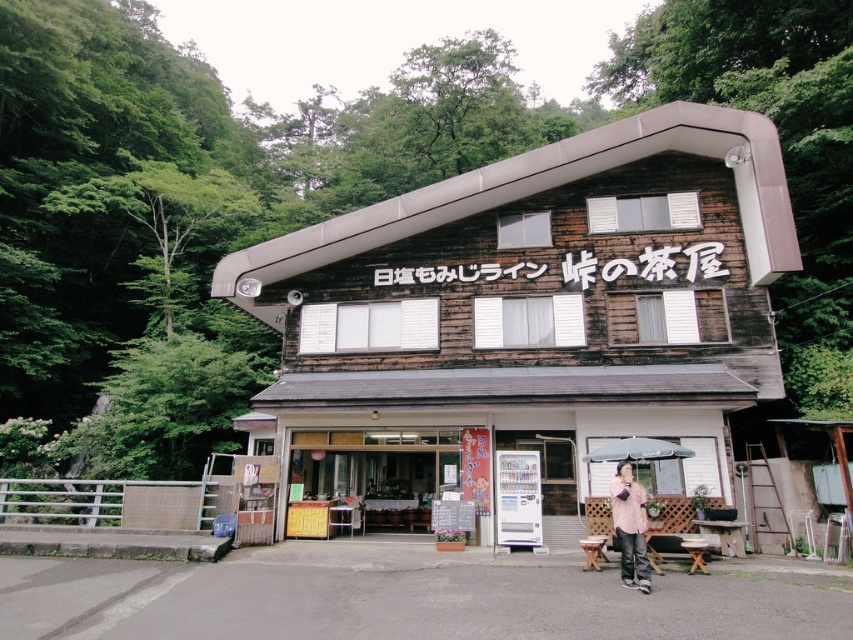
Does weathered wood store at center appear over pink fabric jacket at lower right?

Correct, weathered wood store at center is located above pink fabric jacket at lower right.

Does weathered wood store at center have a smaller size compared to pink fabric jacket at lower right?

No.

You are a GUI agent. You are given a task and a screenshot of the screen. Output one action in this format:
    pyautogui.click(x=<x>, y=<y>)
    Task: Click on the weathered wood store at center
    The width and height of the screenshot is (853, 640).
    Given the screenshot: What is the action you would take?
    pyautogui.click(x=529, y=312)